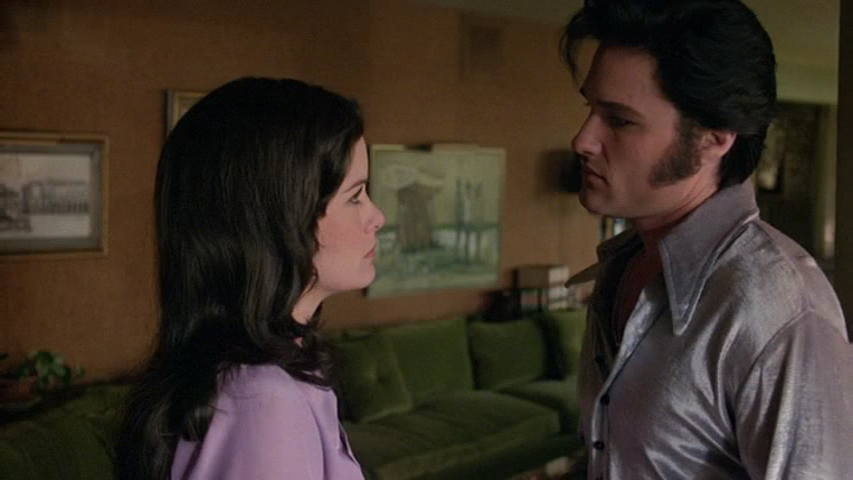
In order to click on wall in this screenshot , I will do `click(449, 52)`.